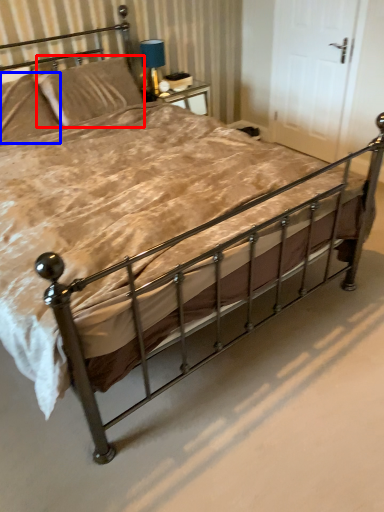
Question: Which of the following is the farthest to the observer, pillow (highlighted by a red box) or pillow (highlighted by a blue box)?

Choices:
 (A) pillow
 (B) pillow

Answer: (A)